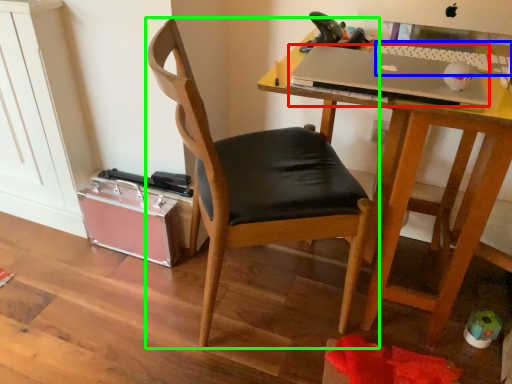
Question: Considering the real-world distances, which object is closest to laptop (highlighted by a red box)? laptop keyboard (highlighted by a blue box) or chair (highlighted by a green box).

Choices:
 (A) laptop keyboard
 (B) chair

Answer: (A)